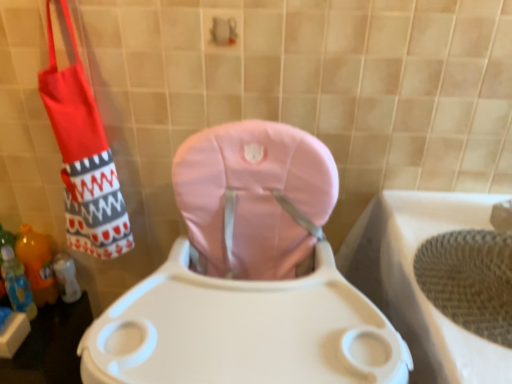
The height and width of the screenshot is (384, 512). Find the location of `free space on the front side of translucent orange bottle at lower left, which appears as the 1th bottle when viewed from the front`. free space on the front side of translucent orange bottle at lower left, which appears as the 1th bottle when viewed from the front is located at coordinates (30, 352).